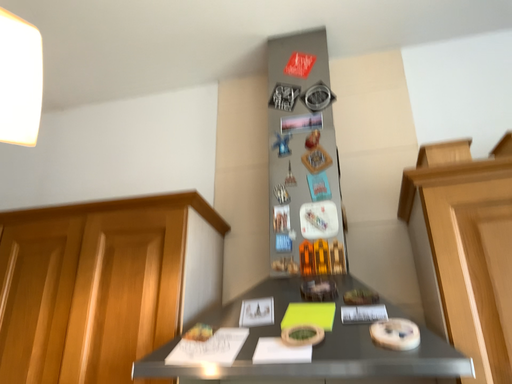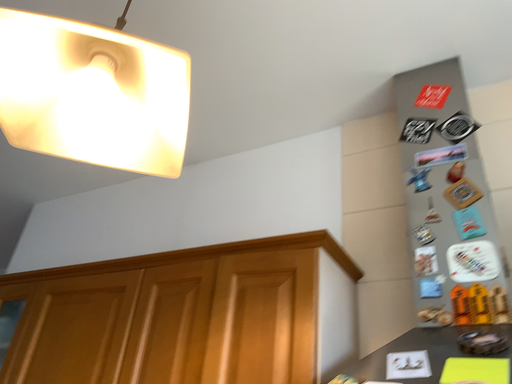
Question: Which way did the camera rotate in the video?

Choices:
 (A) rotated downward
 (B) rotated upward

Answer: (B)